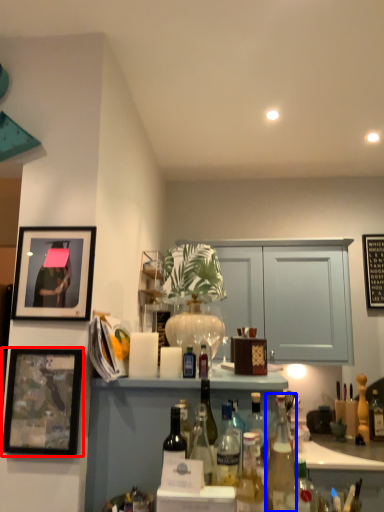
Question: Among these objects, which one is farthest to the camera, picture frame (highlighted by a red box) or bottle (highlighted by a blue box)?

Choices:
 (A) picture frame
 (B) bottle

Answer: (A)